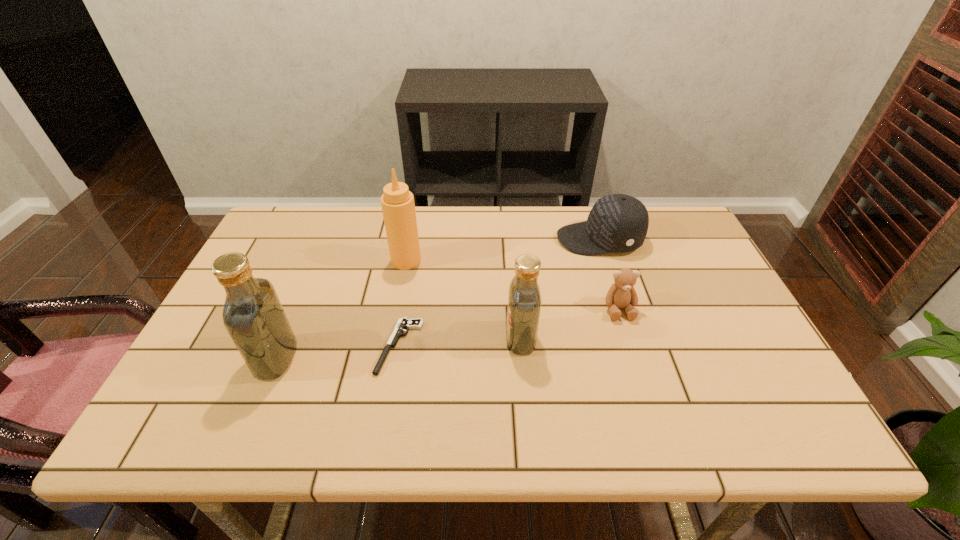
Please point a spot on the right to add another vodka. Please provide its 2D coordinates. Your answer should be formatted as a tuple, i.e. [(x, y)], where the tuple contains the x and y coordinates of a point satisfying the conditions above.

[(747, 320)]